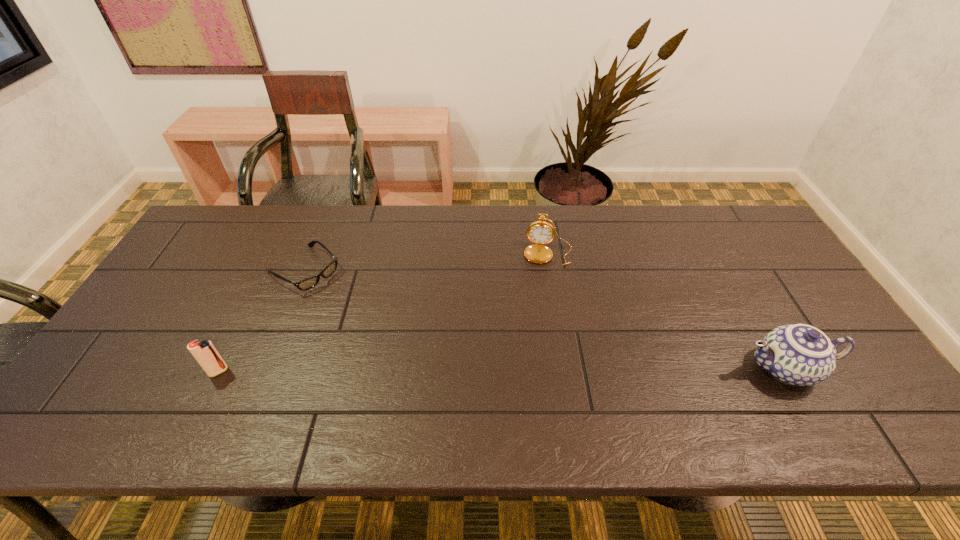
Where is `vacant space on the desktop that is between the igniter and the rightmost object and is positioned on the front-facing side of the shortest object`? The height and width of the screenshot is (540, 960). vacant space on the desktop that is between the igniter and the rightmost object and is positioned on the front-facing side of the shortest object is located at coordinates (435, 370).

You are a GUI agent. You are given a task and a screenshot of the screen. Output one action in this format:
    pyautogui.click(x=<x>, y=<y>)
    Task: Click on the vacant space on the desktop that is between the igniter and the chinaware and is positioned on the face of the second object from right to left
    Image resolution: width=960 pixels, height=540 pixels.
    Given the screenshot: What is the action you would take?
    pyautogui.click(x=539, y=370)